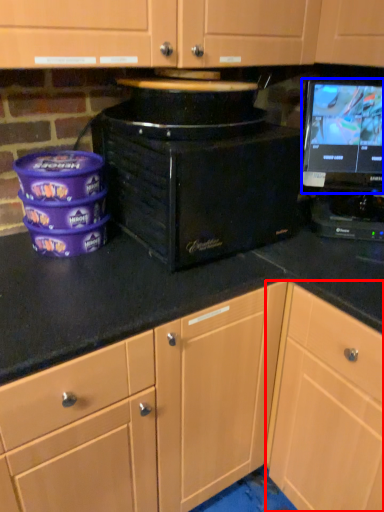
Question: Which point is closer to the camera, cabinetry (highlighted by a red box) or computer monitor (highlighted by a blue box)?

Choices:
 (A) cabinetry
 (B) computer monitor

Answer: (A)